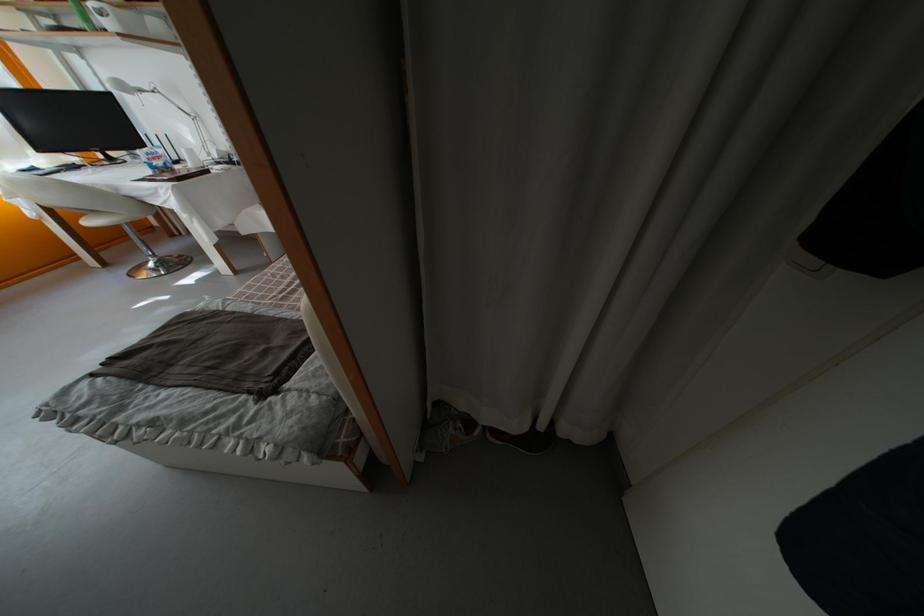
At what (x,y) coordinates should I click in order to perform the action: click on white chair sitting surface. Please return your answer as a coordinate pair (x, y). This screenshot has height=616, width=924. Looking at the image, I should click on (103, 219).